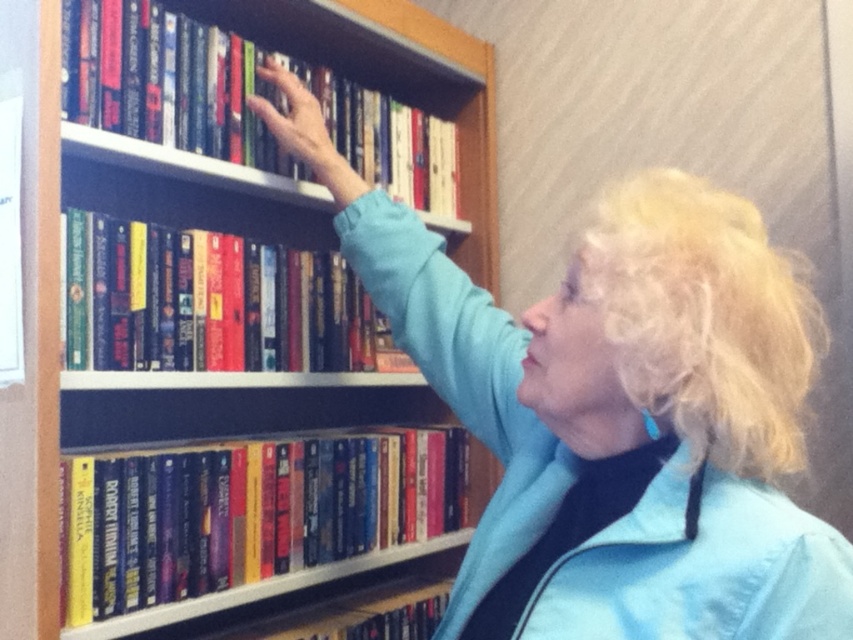
You are a librarian who needs to place a new book on the wooden bookshelf at upper center. The new book is the same size as the hardcover book at upper center. Can you fit it on the shelf?

The wooden bookshelf at upper center is bigger than the hardcover book at upper center, so yes, the new book can fit on the shelf since the bookshelf has enough space.

From the picture: You are a photographer trying to capture a detailed shot of the bookshelf. You notice two points on the bookshelf marked as point 1 and point 2. If point 1 is at coordinate point (730, 577) and point 2 is at coordinate point (161, 196), which point would appear larger in your photo?

Point 1 at coordinate point (730, 577) appears closer to the camera than point 2 at coordinate point (161, 196), so it would appear larger in the photo.